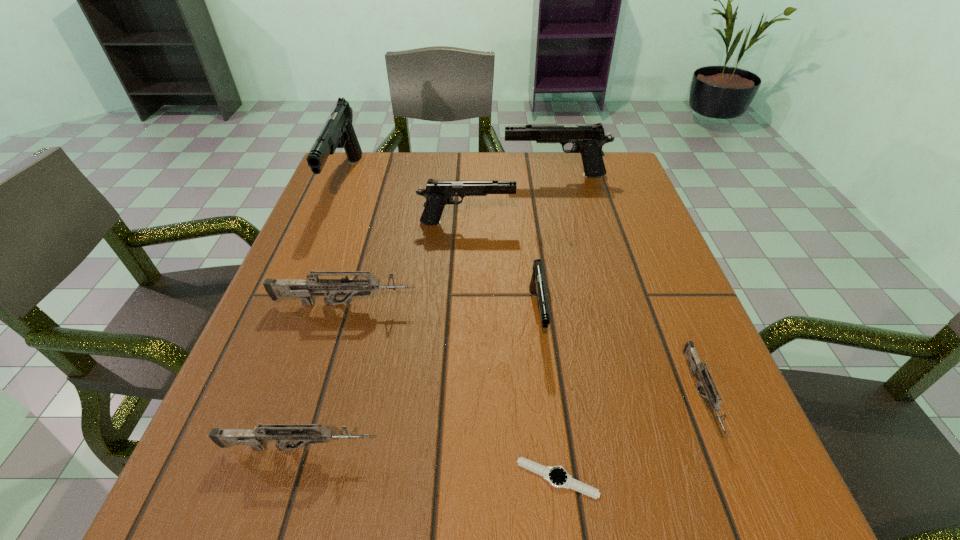
Where is `the tallest object`? The height and width of the screenshot is (540, 960). the tallest object is located at coordinates (338, 132).

What are the coordinates of `the biggest black gun` in the screenshot? It's located at (338, 132).

The width and height of the screenshot is (960, 540). I want to click on the second tallest object, so click(x=588, y=140).

The image size is (960, 540). I want to click on the sixth shortest gun, so click(x=588, y=140).

In order to click on the third biggest black gun in this screenshot , I will do `click(437, 193)`.

You are a GUI agent. You are given a task and a screenshot of the screen. Output one action in this format:
    pyautogui.click(x=<x>, y=<y>)
    Task: Click on the second nearest black gun
    The image size is (960, 540).
    Given the screenshot: What is the action you would take?
    pyautogui.click(x=437, y=193)

Identify the location of the nearest black gun. This screenshot has height=540, width=960. (537, 285).

Where is `the biggest grey gun`? The height and width of the screenshot is (540, 960). the biggest grey gun is located at coordinates (x=303, y=288).

Identify the location of the third shortest object. (282, 433).

Image resolution: width=960 pixels, height=540 pixels. In order to click on the second biggest grey gun in this screenshot , I will do `click(282, 433)`.